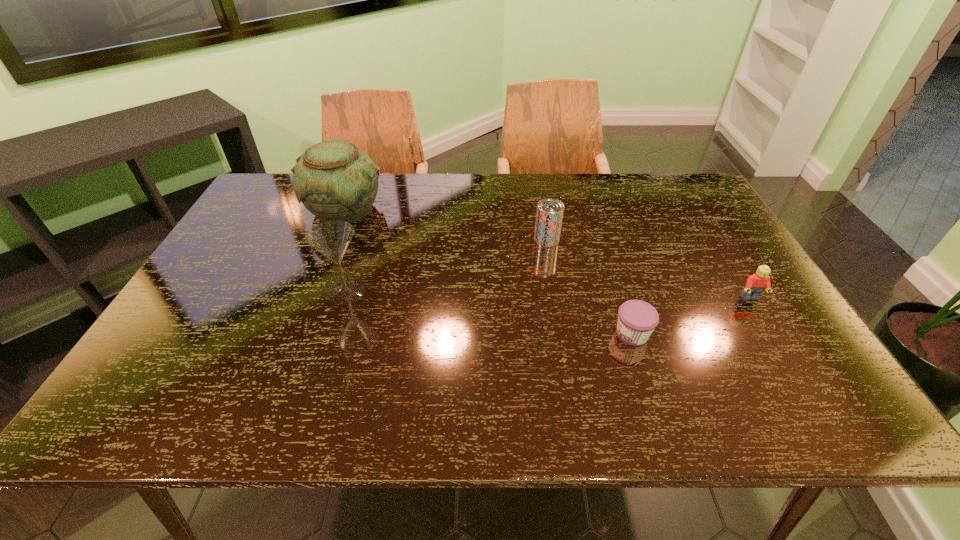
At what (x,y) coordinates should I click in order to perform the action: click on vacant space that satisfies the following two spatial constraints: 1. on the front side of the pottery; 2. on the right side of the beer can. Please return your answer as a coordinate pair (x, y). This screenshot has height=540, width=960. Looking at the image, I should click on (334, 239).